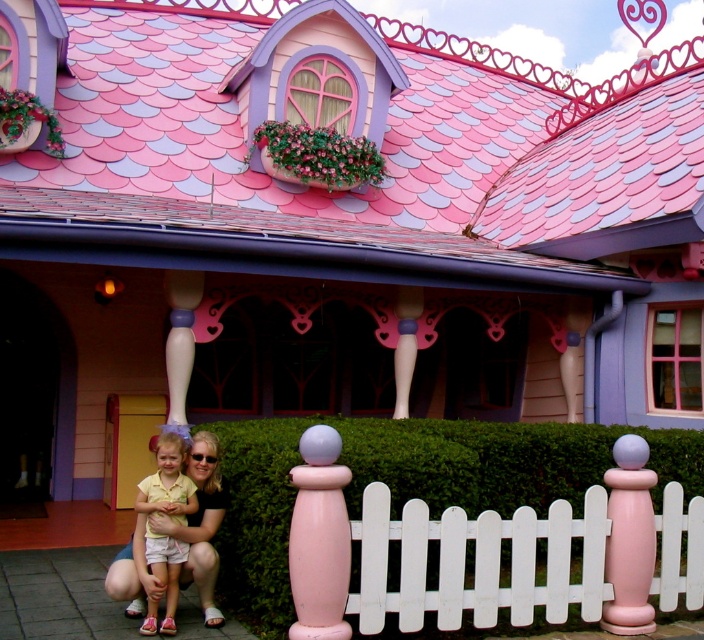
Question: Which of the following is the closest to the observer?

Choices:
 (A) (425, 570)
 (B) (151, 497)
 (C) (272, 497)

Answer: (A)

Question: Which point is farther to the camera?

Choices:
 (A) white picket fence at center
 (B) green hedge at center

Answer: (B)

Question: Does white picket fence at center have a lesser width compared to pastel yellow shirt at lower left?

Choices:
 (A) yes
 (B) no

Answer: (B)

Question: Is the position of white picket fence at center more distant than that of pastel yellow shirt at lower left?

Choices:
 (A) yes
 (B) no

Answer: (B)

Question: Estimate the real-world distances between objects in this image. Which object is closer to the green hedge at center?

Choices:
 (A) pastel yellow shirt at lower left
 (B) white picket fence at center

Answer: (B)

Question: Can you confirm if green hedge at center is smaller than pastel yellow shirt at lower left?

Choices:
 (A) no
 (B) yes

Answer: (A)